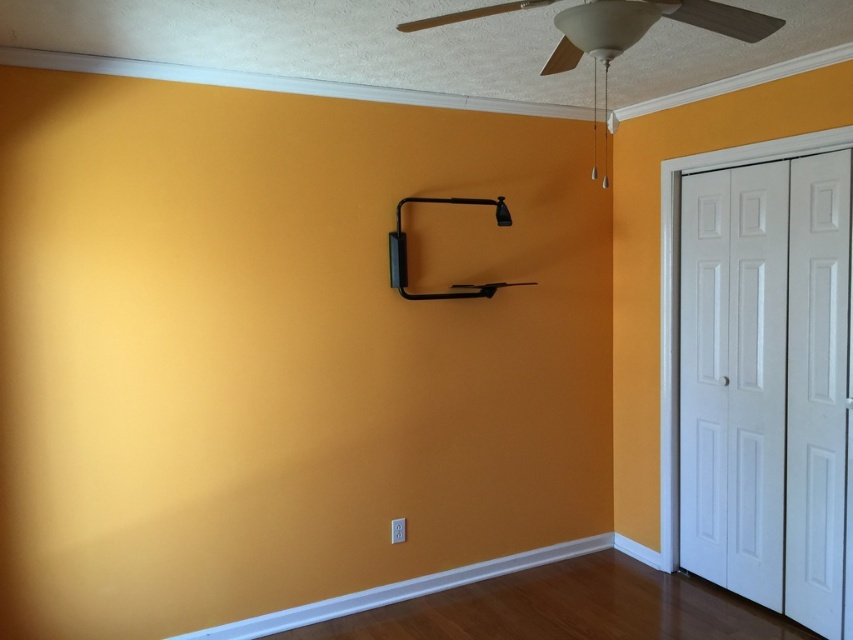
Question: Is white matte ceiling fan at upper center below black matte/finish bookshelf at upper center?

Choices:
 (A) yes
 (B) no

Answer: (B)

Question: Which of the following is the farthest from the observer?

Choices:
 (A) white matte ceiling fan at upper center
 (B) black matte/finish bookshelf at upper center

Answer: (B)

Question: Can you confirm if white matte ceiling fan at upper center is smaller than black matte/finish bookshelf at upper center?

Choices:
 (A) no
 (B) yes

Answer: (B)

Question: Among these objects, which one is farthest from the camera?

Choices:
 (A) white matte ceiling fan at upper center
 (B) white smooth baseboard at lower center
 (C) black matte/finish bookshelf at upper center

Answer: (C)

Question: Which object is the farthest from the white smooth baseboard at lower center?

Choices:
 (A) black matte/finish bookshelf at upper center
 (B) white matte ceiling fan at upper center

Answer: (B)

Question: Can you confirm if white matte ceiling fan at upper center is positioned to the left of black matte/finish bookshelf at upper center?

Choices:
 (A) yes
 (B) no

Answer: (B)